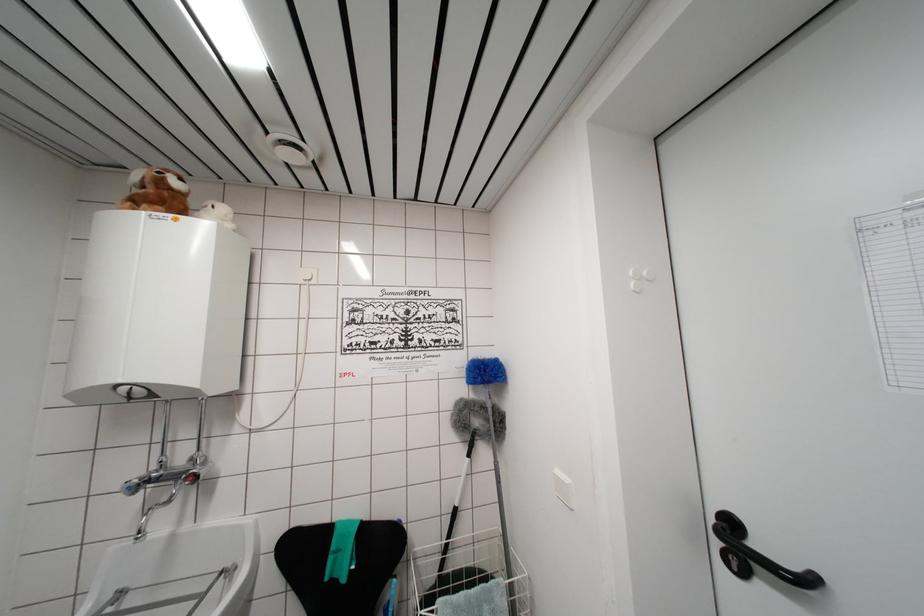
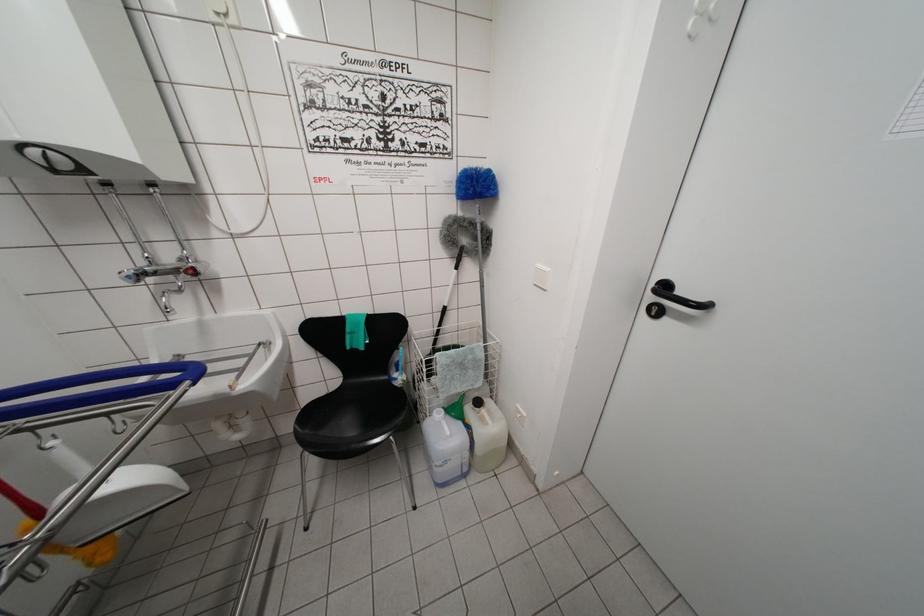
Question: Based on the continuous images, in which direction is the camera rotating? Reply with the corresponding letter.

Choices:
 (A) Left
 (B) Right
 (C) Up
 (D) Down

Answer: (D)